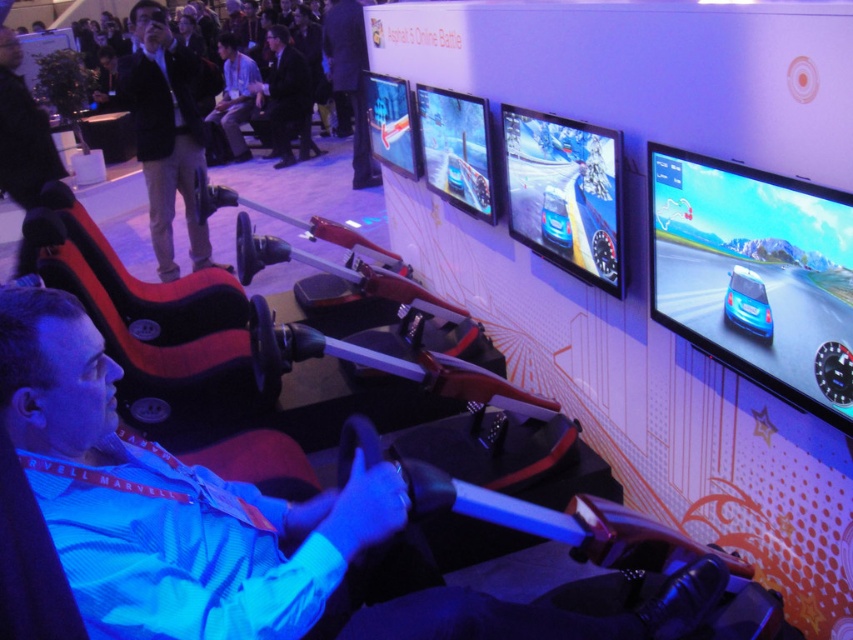
What do you see at coordinates (242, 525) in the screenshot?
I see `blue fabric shirt at center` at bounding box center [242, 525].

Between point (253, 563) and point (556, 232), which one is positioned behind?

Point (556, 232)

The height and width of the screenshot is (640, 853). What are the coordinates of `blue fabric shirt at center` in the screenshot? It's located at (242, 525).

Can you confirm if blue fabric shirt at center is taller than dark suit at upper center?

No.

Does blue fabric shirt at center have a larger size compared to dark suit at upper center?

Actually, blue fabric shirt at center might be smaller than dark suit at upper center.

At what (x,y) coordinates should I click in order to perform the action: click on blue fabric shirt at center. Please return your answer as a coordinate pair (x, y). Looking at the image, I should click on (242, 525).

The width and height of the screenshot is (853, 640). Identify the location of blue fabric shirt at center. (242, 525).

Who is higher up, blue fabric shirt at center or black leather jacket at upper left?

black leather jacket at upper left is higher up.

Does blue fabric shirt at center appear on the left side of black leather jacket at upper left?

Incorrect, blue fabric shirt at center is not on the left side of black leather jacket at upper left.

Locate an element on the screen. blue fabric shirt at center is located at coordinates (242, 525).

Image resolution: width=853 pixels, height=640 pixels. I want to click on blue fabric shirt at center, so click(x=242, y=525).